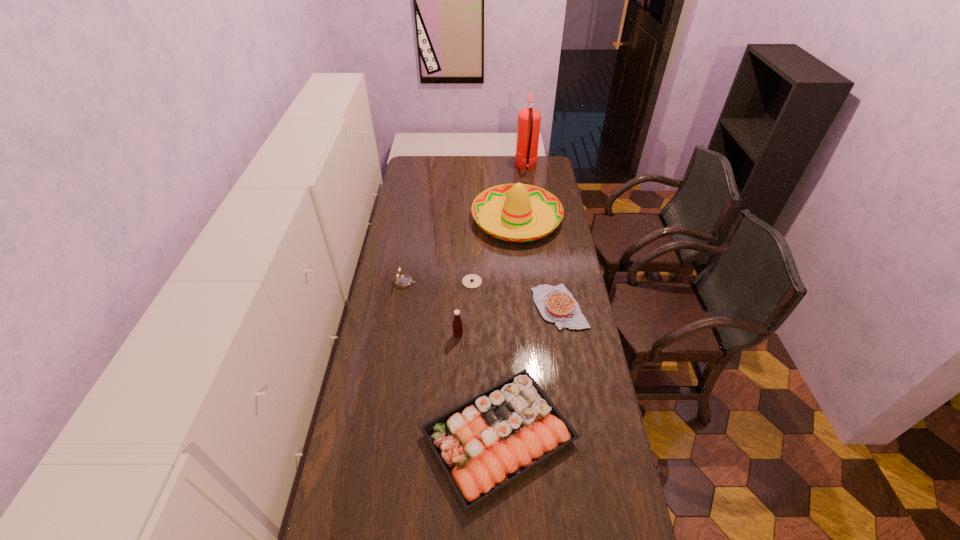
I want to click on the second closest compass to the Tabasco sauce, so click(403, 281).

At what (x,y) coordinates should I click in order to perform the action: click on free space that satisfies the following two spatial constraints: 1. towards the nozzle of the farthest object; 2. on the front side of the platter. Please return your answer as a coordinate pair (x, y). The image size is (960, 540). Looking at the image, I should click on (564, 437).

In order to click on vacant region that satisfies the following two spatial constraints: 1. with the dial facing the nearest object; 2. on the left side of the fourth tallest object in this screenshot , I will do `click(379, 437)`.

The height and width of the screenshot is (540, 960). I want to click on vacant space that satisfies the following two spatial constraints: 1. on the back side of the platter; 2. on the left side of the sombrero, so click(492, 218).

I want to click on vacant position in the image that satisfies the following two spatial constraints: 1. towards the nozzle of the farthest object; 2. on the front side of the second tallest object, so click(533, 218).